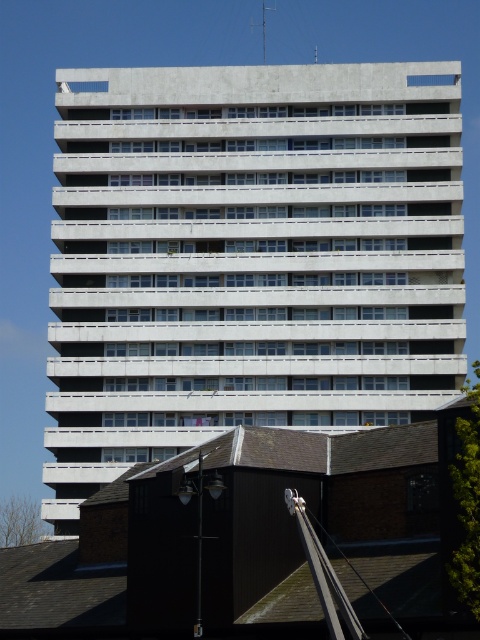
You are standing at the coordinates point 0.0, 0.0 and want to reach the gray concrete building at center. According to the map, what are the coordinates you need to navigate to?

The gray concrete building at center is located at point (249, 257), so you need to navigate to coordinates (249, 257).

You are a construction worker standing at the base of the metallic silver crane at upper center. You need to deliver materials to the gray concrete building at center. Given that the crane can reach up to 150 meters, can it safely transport materials to the building?

The gray concrete building at center is 156.32 meters from the metallic silver crane at upper center. Since the crane can only reach up to 150 meters, it cannot safely transport materials to the building because the distance exceeds its maximum reach.

You are standing on the sidewalk in front of the gray concrete building at center and the metallic silver crane at upper center. Which object is positioned to the left?

The metallic silver crane at upper center is positioned to the left of the gray concrete building at center.